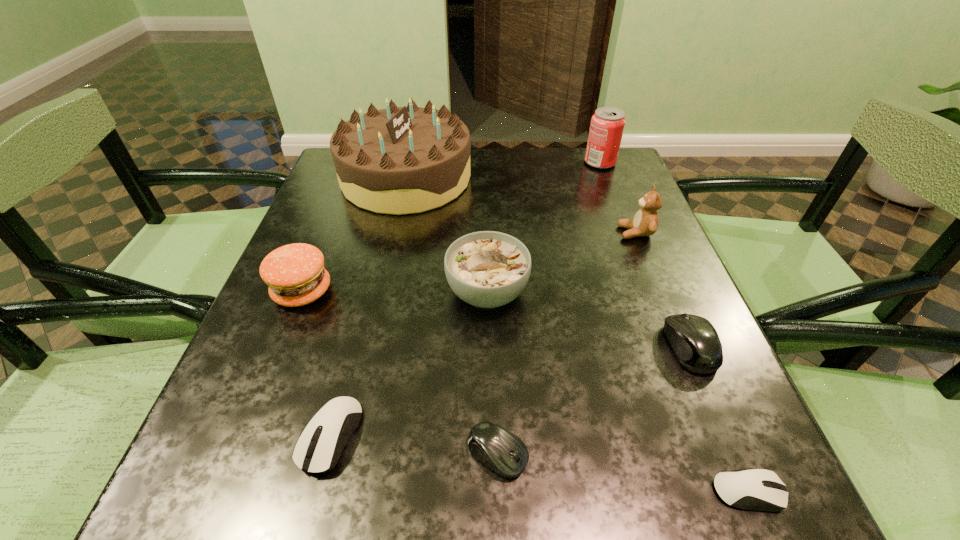
At what (x,y) coordinates should I click in order to perform the action: click on the left white mouse. Please return your answer as a coordinate pair (x, y). This screenshot has width=960, height=540. Looking at the image, I should click on (337, 420).

Identify the location of the third mouse from right to left. click(502, 451).

Find the location of `the nearer black mouse`. the nearer black mouse is located at coordinates (502, 451).

At what (x,y) coordinates should I click in order to perform the action: click on the shortest object. Please return your answer as a coordinate pair (x, y). Image resolution: width=960 pixels, height=540 pixels. Looking at the image, I should click on (760, 489).

What are the coordinates of `the shortest mouse` in the screenshot? It's located at (760, 489).

Find the location of a particular element. This screenshot has height=540, width=960. blank space located 0.100m on the front-facing side of the birthday cake is located at coordinates (510, 178).

This screenshot has height=540, width=960. Find the location of `free space located on the left of the soda can`. free space located on the left of the soda can is located at coordinates (437, 163).

At what (x,y) coordinates should I click in order to perform the action: click on free space located 0.110m on the front-facing side of the teddy bear. Please return your answer as a coordinate pair (x, y). Looking at the image, I should click on (569, 233).

At what (x,y) coordinates should I click in order to perform the action: click on vacant space located on the front-facing side of the teddy bear. Please return your answer as a coordinate pair (x, y). Looking at the image, I should click on (489, 233).

Identify the location of blank area located 0.400m on the front-facing side of the teddy bear. The height and width of the screenshot is (540, 960). coord(439,233).